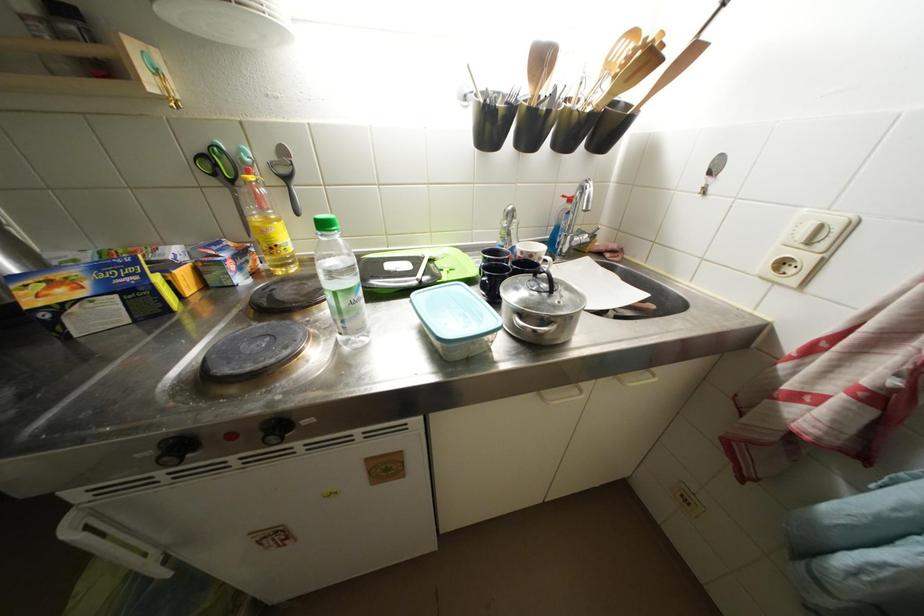
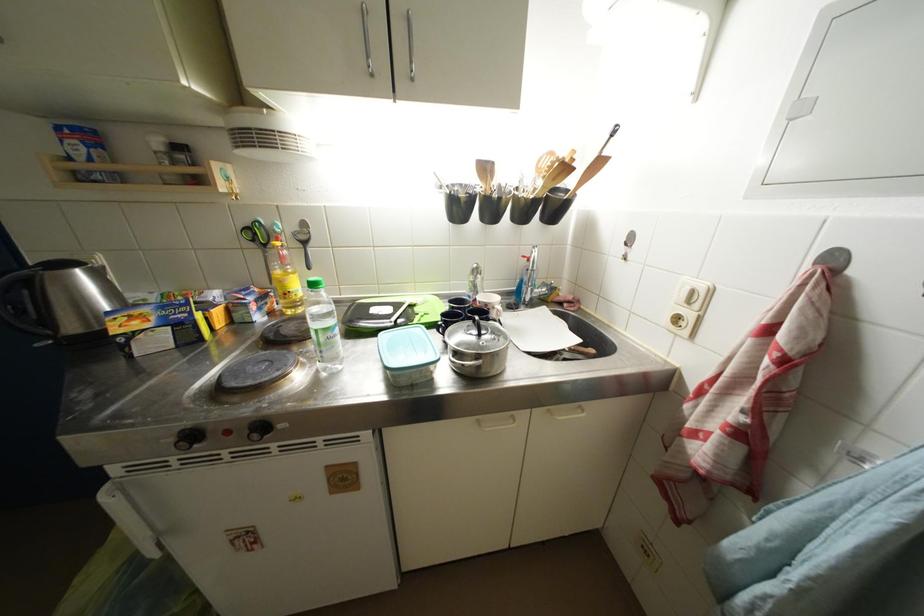
In the second image, find the point that corresponds to (157,456) in the first image.

(178, 444)